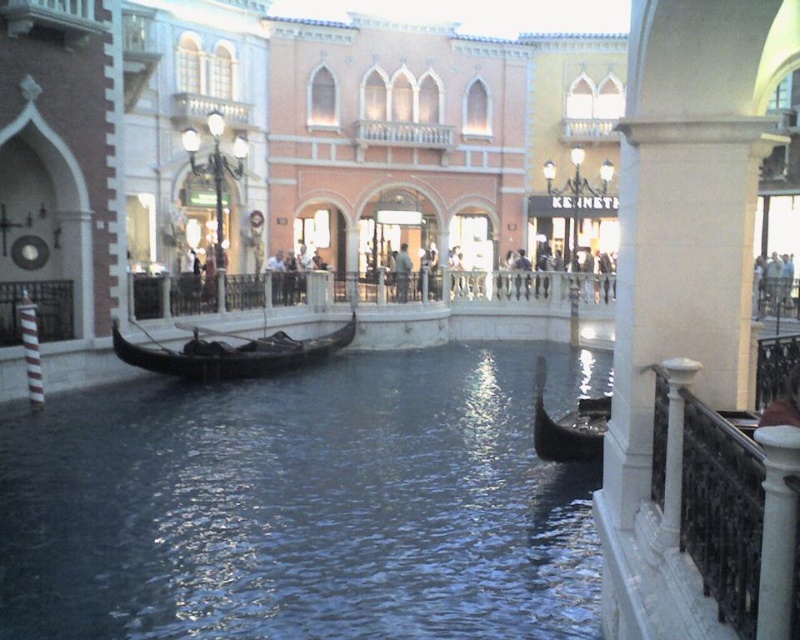
Question: Which of the following is the farthest from the observer?

Choices:
 (A) (400, 282)
 (B) (264, 428)
 (C) (584, 413)

Answer: (A)

Question: Among these points, which one is farthest from the camera?

Choices:
 (A) (120, 348)
 (B) (404, 285)
 (C) (400, 394)
 (D) (594, 403)

Answer: (B)

Question: Which object is positioned farthest from the wooden gondola at lower right?

Choices:
 (A) clear water at center
 (B) black polished wood gondola at center

Answer: (B)

Question: Can you confirm if clear water at center is wider than black polished wood gondola at center?

Choices:
 (A) yes
 (B) no

Answer: (A)

Question: Is clear water at center wider than black polished wood gondola at center?

Choices:
 (A) yes
 (B) no

Answer: (A)

Question: Is clear water at center bigger than dark gray fabric jacket at center?

Choices:
 (A) no
 (B) yes

Answer: (B)